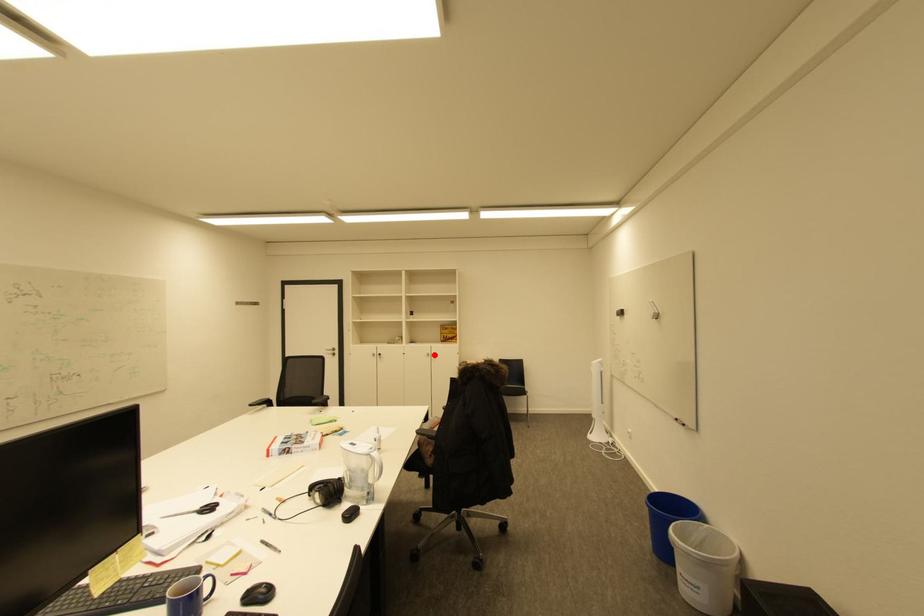
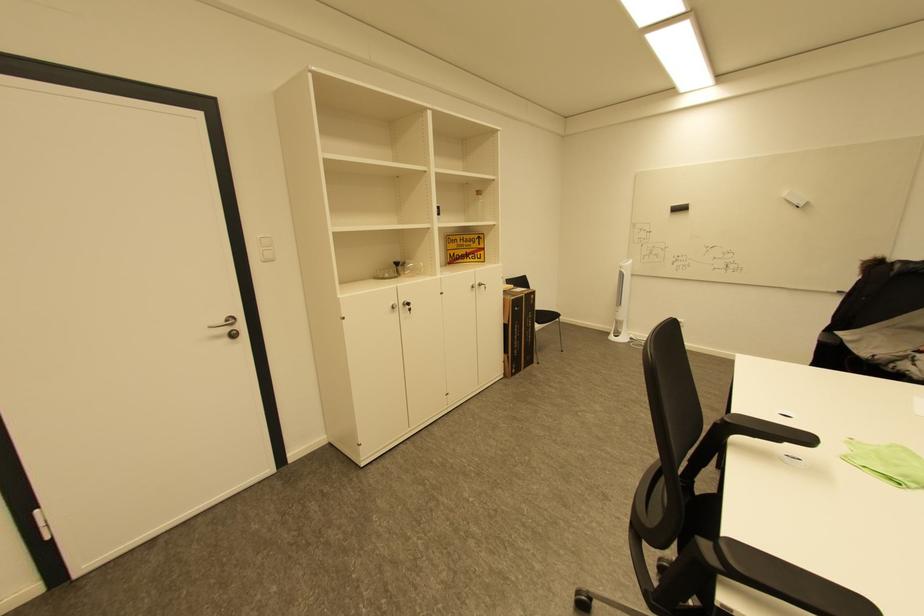
Question: I am providing you with two images of the same scene from different viewpoints. In image1, a red point is highlighted. Considering the same 3D point in image2, which of the following is correct?

Choices:
 (A) It is closer
 (B) It is farther

Answer: (A)